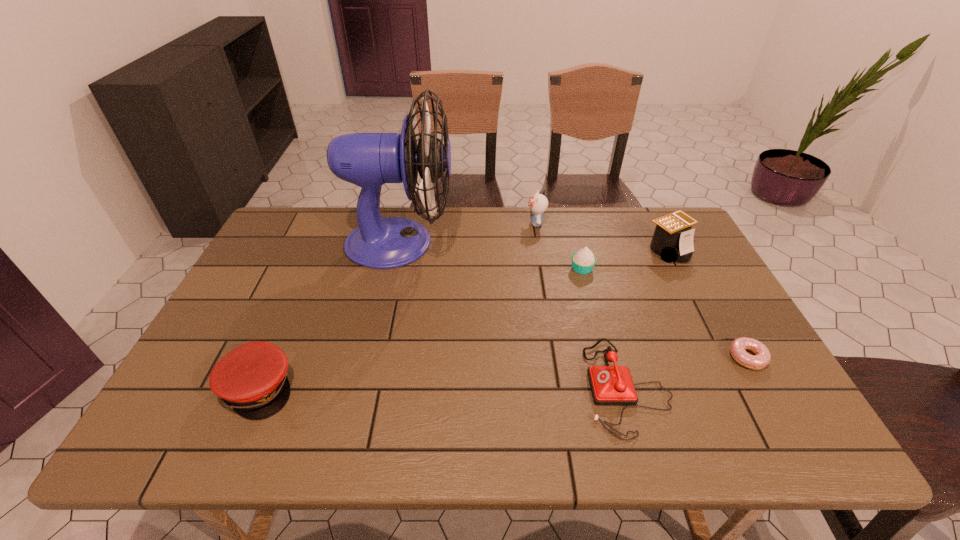
Identify the location of vacant space that satisfies the following two spatial constraints: 1. on the front-facing side of the third object from left to right; 2. on the right side of the cupcake. (543, 268).

Find the location of a particular element. The height and width of the screenshot is (540, 960). vacant space that satisfies the following two spatial constraints: 1. on the front-facing side of the kitten; 2. on the back side of the cupcake is located at coordinates (543, 268).

The image size is (960, 540). Identify the location of vacant space that satisfies the following two spatial constraints: 1. on the front-facing side of the third object from left to right; 2. on the left side of the calculator. (540, 250).

Where is `blank space that satisfies the following two spatial constraints: 1. in front of the calculator where the airflow is directed; 2. on the left side of the tallest object`? The image size is (960, 540). blank space that satisfies the following two spatial constraints: 1. in front of the calculator where the airflow is directed; 2. on the left side of the tallest object is located at coordinates (398, 250).